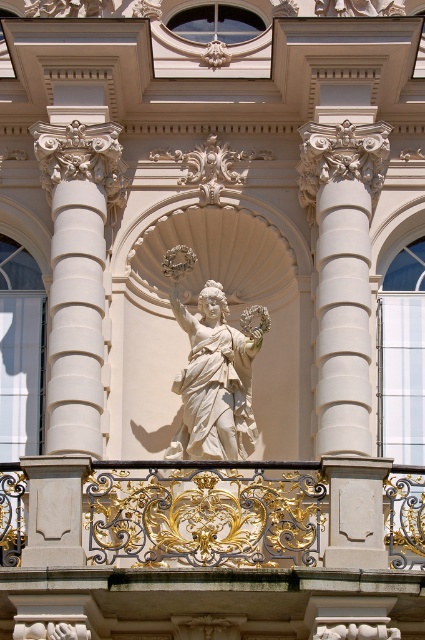
Consider the image. You are an architect analyzing the symmetry of the facade. The gold wrought iron at center is represented by point (204, 513). Is this point located to the left or right of the central niche housing the statue of a woman?

The gold wrought iron at center is represented by point (204, 513), which is located at the center of the facade. Since the central niche is the focal point, the point is directly aligned with the niche, so it is neither to the left nor the right but exactly at the center.

You are an architect examining the facade. You notice the gold wrought iron at center and the white marble statue at center. Which object is positioned to the right of the other?

The gold wrought iron at center is to the right of the white marble statue at center.

You are an architect examining the facade and need to determine the spatial relationship between two specific points on the structure. Which of the two points, point (x=167, y=472) or point (x=221, y=394), is positioned closer to your viewpoint?

Point (x=167, y=472) is closer to the viewer than point (x=221, y=394).